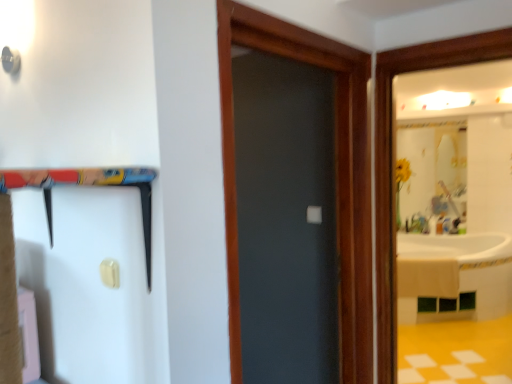
The width and height of the screenshot is (512, 384). What do you see at coordinates (88, 185) in the screenshot? I see `white plastic barn door at upper left` at bounding box center [88, 185].

The width and height of the screenshot is (512, 384). Find the location of `white plastic barn door at upper left`. white plastic barn door at upper left is located at coordinates (88, 185).

What do you see at coordinates (336, 173) in the screenshot?
I see `matte gray door at center` at bounding box center [336, 173].

At what (x,y) coordinates should I click in order to perform the action: click on matte gray door at center. Please return your answer as a coordinate pair (x, y). Looking at the image, I should click on (336, 173).

What is the approximate width of matte gray door at center?

It is 13.62 centimeters.

I want to click on white plastic barn door at upper left, so click(88, 185).

Can you confirm if white plastic barn door at upper left is positioned to the left of matte gray door at center?

Correct, you'll find white plastic barn door at upper left to the left of matte gray door at center.

Consider the image. Which object is closer to the camera, white plastic barn door at upper left or matte gray door at center?

white plastic barn door at upper left is closer to the camera.

Is point (112, 282) positioned before point (230, 294)?

Yes, point (112, 282) is closer to viewer.

In the scene shown: From the image's perspective, is white plastic barn door at upper left on matte gray door at center?

Actually, white plastic barn door at upper left appears below matte gray door at center in the image.

Looking at this image, from a real-world perspective, is white plastic barn door at upper left above or below matte gray door at center?

white plastic barn door at upper left is below matte gray door at center.

Based on the photo, which object is thinner, white plastic barn door at upper left or matte gray door at center?

With smaller width is matte gray door at center.

Which of these two, white plastic barn door at upper left or matte gray door at center, stands taller?

Standing taller between the two is matte gray door at center.

Looking at the image, does white plastic barn door at upper left seem bigger or smaller compared to matte gray door at center?

Clearly, white plastic barn door at upper left is larger in size than matte gray door at center.

Looking at this image, is white plastic barn door at upper left positioned beyond the bounds of matte gray door at center?

Yes, white plastic barn door at upper left is located beyond the bounds of matte gray door at center.

Is white plastic barn door at upper left not close to matte gray door at center?

white plastic barn door at upper left is near matte gray door at center, not far away.

Is white plastic barn door at upper left positioned with its back to matte gray door at center?

Yes.

How many degrees apart are the facing directions of white plastic barn door at upper left and matte gray door at center?

They differ by 91.6 degrees in their facing directions.

Identify the location of barn door on the left of matte gray door at center. The image size is (512, 384). (88, 185).

Considering the relative positions of matte gray door at center and white plastic barn door at upper left in the image provided, is matte gray door at center to the left or to the right of white plastic barn door at upper left?

matte gray door at center is positioned on white plastic barn door at upper left's right side.

Which object is closer to the camera taking this photo, matte gray door at center or white plastic barn door at upper left?

Positioned in front is white plastic barn door at upper left.

Considering the positions of point (334, 42) and point (150, 173), is point (334, 42) closer or farther from the camera than point (150, 173)?

Point (334, 42).

From the image's perspective, is matte gray door at center over white plastic barn door at upper left?

Yes, from the image's perspective, matte gray door at center is above white plastic barn door at upper left.

From a real-world perspective, is matte gray door at center on white plastic barn door at upper left?

Yes, from a real-world perspective, matte gray door at center is above white plastic barn door at upper left.

Considering the sizes of matte gray door at center and white plastic barn door at upper left in the image, is matte gray door at center wider or thinner than white plastic barn door at upper left?

matte gray door at center is thinner than white plastic barn door at upper left.

Can you confirm if matte gray door at center is shorter than white plastic barn door at upper left?

In fact, matte gray door at center may be taller than white plastic barn door at upper left.

Consider the image. Between matte gray door at center and white plastic barn door at upper left, which one has smaller size?

matte gray door at center is smaller.

Can white plastic barn door at upper left be found inside matte gray door at center?

No, white plastic barn door at upper left is located outside of matte gray door at center.

Is matte gray door at center not close to white plastic barn door at upper left?

They are positioned close to each other.

Is matte gray door at center oriented away from white plastic barn door at upper left?

That's not correct — matte gray door at center is not looking away from white plastic barn door at upper left.

How different are the orientations of matte gray door at center and white plastic barn door at upper left in degrees?

The facing directions of matte gray door at center and white plastic barn door at upper left are 91.6 degrees apart.

How far apart are matte gray door at center and white plastic barn door at upper left?

The distance of matte gray door at center from white plastic barn door at upper left is 28.64 inches.

This screenshot has width=512, height=384. What are the coordinates of `barn door that appears on the left of matte gray door at center` in the screenshot? It's located at (88, 185).

The image size is (512, 384). Find the location of `barn door that is in front of the matte gray door at center`. barn door that is in front of the matte gray door at center is located at coordinates (88, 185).

Image resolution: width=512 pixels, height=384 pixels. Identify the location of barn door that is under the matte gray door at center (from a real-world perspective). [x=88, y=185].